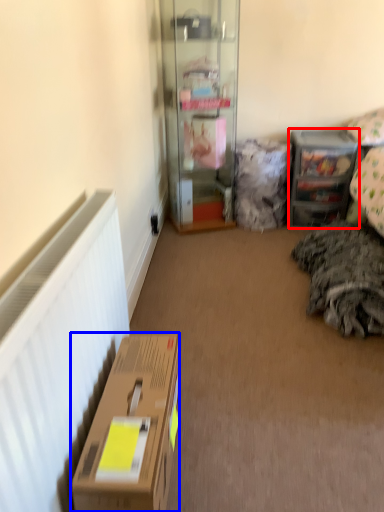
Question: Which of the following is the farthest to the observer, shelf (highlighted by a red box) or box (highlighted by a blue box)?

Choices:
 (A) shelf
 (B) box

Answer: (A)